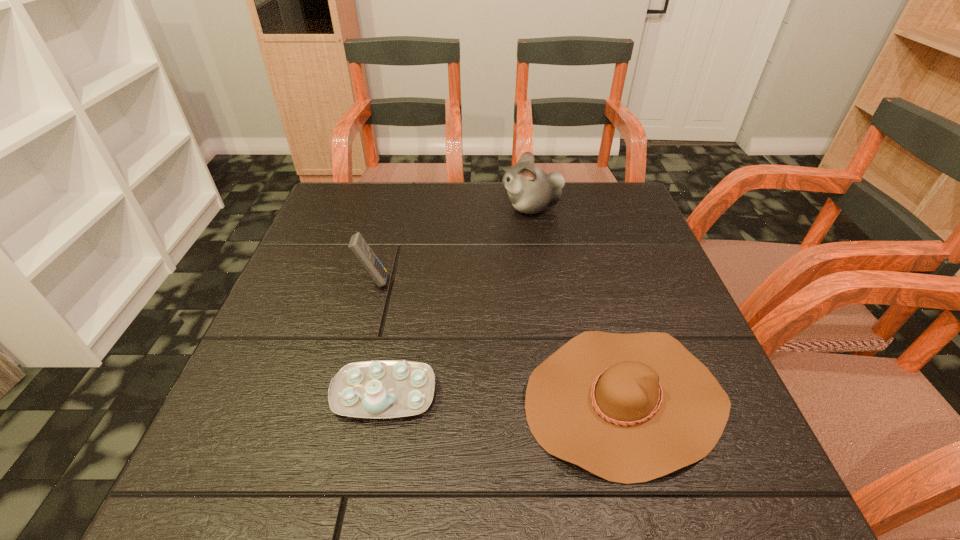
Where is `free space at the right edge`? free space at the right edge is located at coordinates (616, 277).

Where is `free space at the far left corner of the desktop`? This screenshot has height=540, width=960. free space at the far left corner of the desktop is located at coordinates (356, 204).

Where is `vacant space at the far right corner of the desktop`? vacant space at the far right corner of the desktop is located at coordinates (637, 205).

Locate an element on the screen. This screenshot has width=960, height=540. unoccupied position between the second farthest object and the chinaware is located at coordinates (379, 337).

Locate an element on the screen. free space between the chinaware and the cowboy hat is located at coordinates (504, 396).

I want to click on free space between the farthest object and the cowboy hat, so click(578, 303).

The width and height of the screenshot is (960, 540). What are the coordinates of `blank region between the second tallest object and the shortest object` in the screenshot? It's located at (499, 340).

Identify the location of free point between the hamster and the shortest object. (578, 303).

Find the location of a particular element. free space between the chinaware and the cowboy hat is located at coordinates (504, 396).

Locate an element on the screen. unoccupied position between the shortest object and the calculator is located at coordinates (499, 340).